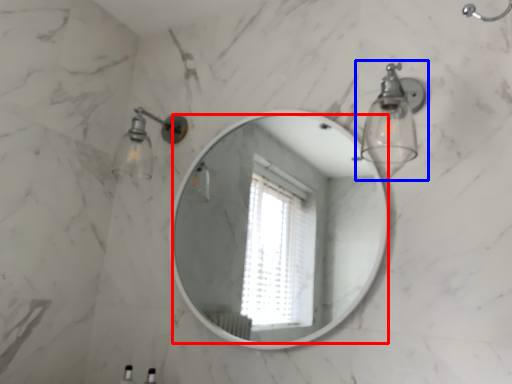
Question: Among these objects, which one is farthest to the camera, mirror (highlighted by a red box) or light fixture (highlighted by a blue box)?

Choices:
 (A) mirror
 (B) light fixture

Answer: (A)